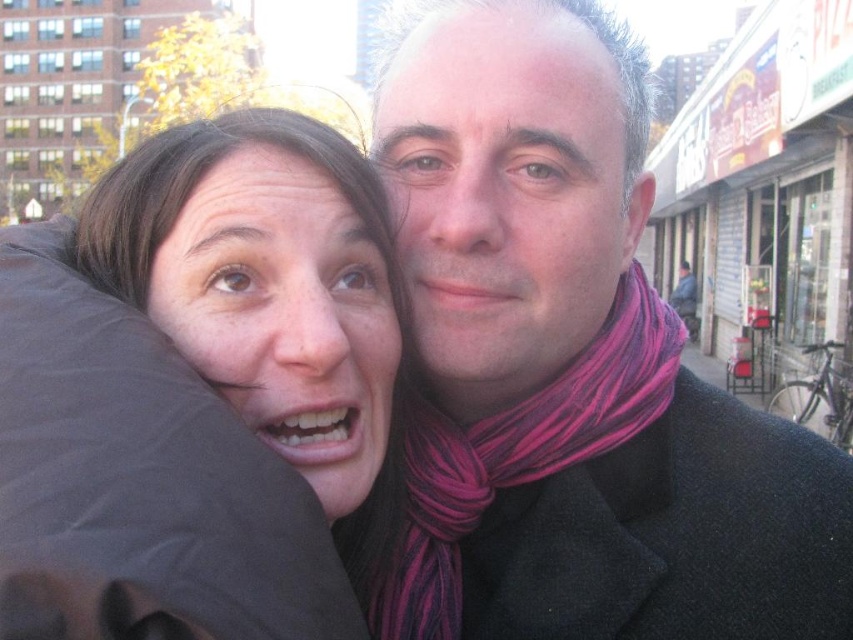
Is dark wool scarf at center bigger than matte black jacket at left?

Correct, dark wool scarf at center is larger in size than matte black jacket at left.

In order to click on dark wool scarf at center in this screenshot , I will do `click(573, 365)`.

You are a GUI agent. You are given a task and a screenshot of the screen. Output one action in this format:
    pyautogui.click(x=<x>, y=<y>)
    Task: Click on the dark wool scarf at center
    This screenshot has width=853, height=640.
    Given the screenshot: What is the action you would take?
    pyautogui.click(x=573, y=365)

Can you confirm if dark wool scarf at center is smaller than pink striped scarf at right?

No.

Is dark wool scarf at center bigger than pink striped scarf at right?

Correct, dark wool scarf at center is larger in size than pink striped scarf at right.

Is point (421, 454) positioned after point (372, 580)?

Yes, it is.

I want to click on dark wool scarf at center, so click(573, 365).

Is matte black jacket at left bigger than pink striped scarf at right?

No, matte black jacket at left is not bigger than pink striped scarf at right.

Who is more forward, (322, 362) or (445, 563)?

Positioned in front is point (322, 362).

Find the location of a particular element. matte black jacket at left is located at coordinates (264, 280).